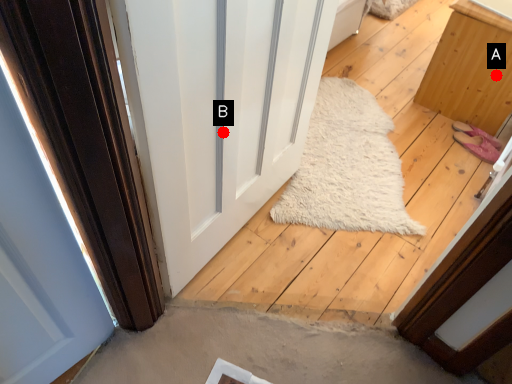
Question: Two points are circled on the image, labeled by A and B beside each circle. Which point is farther from the camera taking this photo?

Choices:
 (A) A is further
 (B) B is further

Answer: (A)